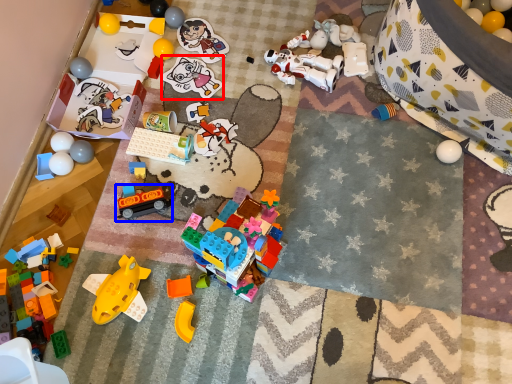
Question: Which of the following is the closest to the observer, toy (highlighted by a red box) or toy (highlighted by a blue box)?

Choices:
 (A) toy
 (B) toy

Answer: (B)